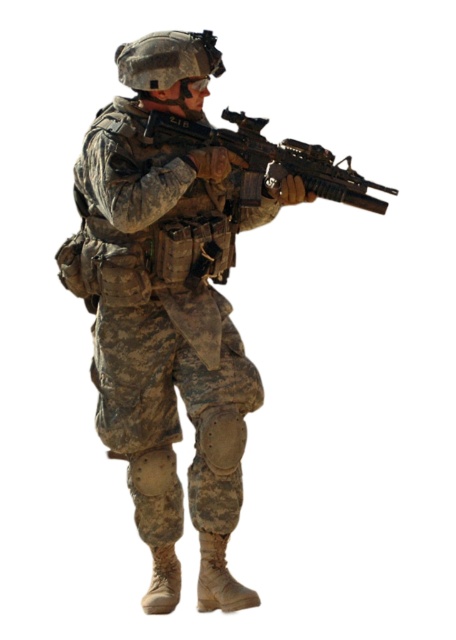
Is camouflage fabric uniform at center smaller than matte black rifle at center?

No, camouflage fabric uniform at center is not smaller than matte black rifle at center.

Is camouflage fabric uniform at center positioned before matte black rifle at center?

No, it is behind matte black rifle at center.

Locate an element on the screen. The image size is (456, 640). camouflage fabric uniform at center is located at coordinates (155, 308).